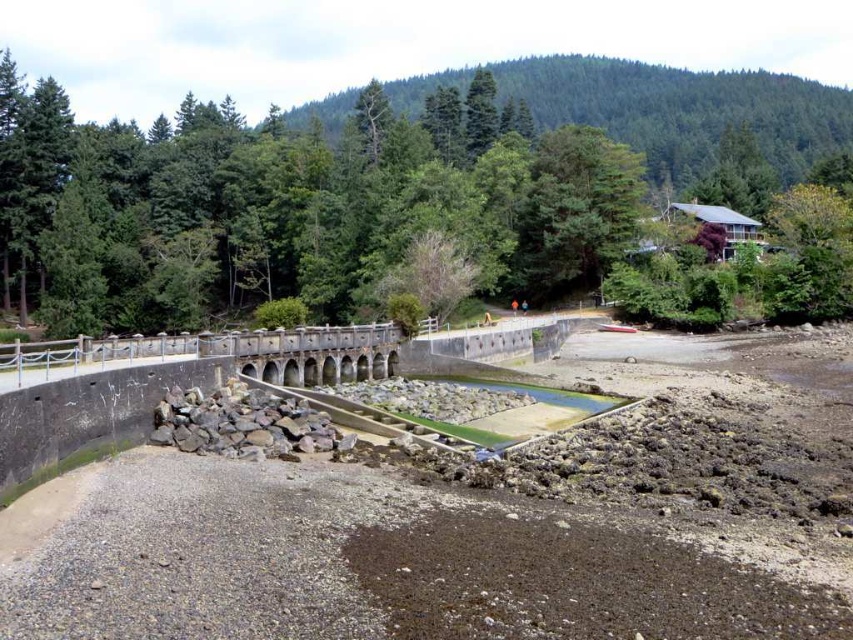
Question: Where is green leafy tree at upper center located in relation to stone arch bridge at center in the image?

Choices:
 (A) above
 (B) below

Answer: (A)

Question: Which of the following is the farthest from the observer?

Choices:
 (A) stone arch bridge at center
 (B) green leafy tree at upper center

Answer: (B)

Question: Is green leafy tree at upper center above stone arch bridge at center?

Choices:
 (A) yes
 (B) no

Answer: (A)

Question: Which object is farther from the camera taking this photo?

Choices:
 (A) stone arch bridge at center
 (B) green leafy tree at upper center

Answer: (B)

Question: Can you confirm if green leafy tree at upper center is thinner than stone arch bridge at center?

Choices:
 (A) no
 (B) yes

Answer: (A)